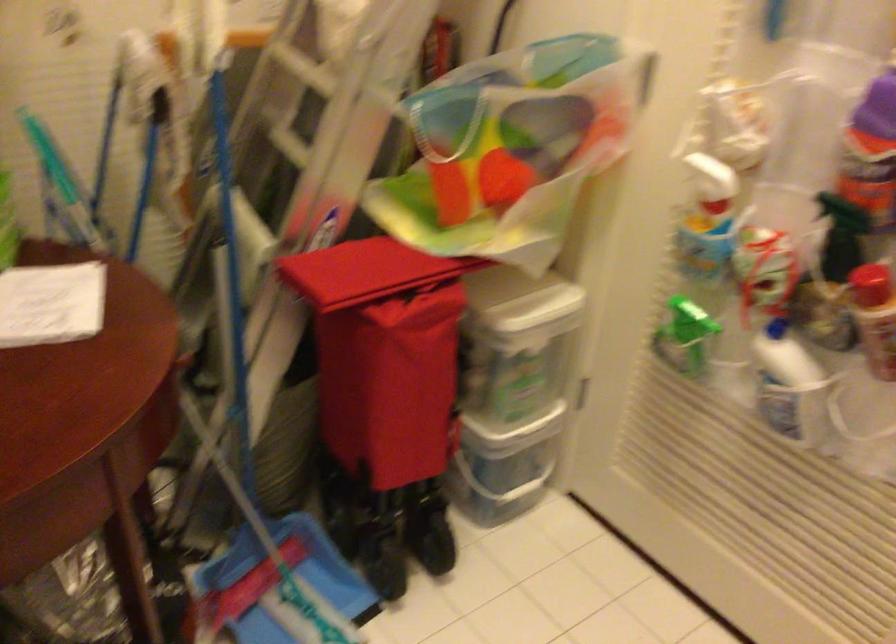
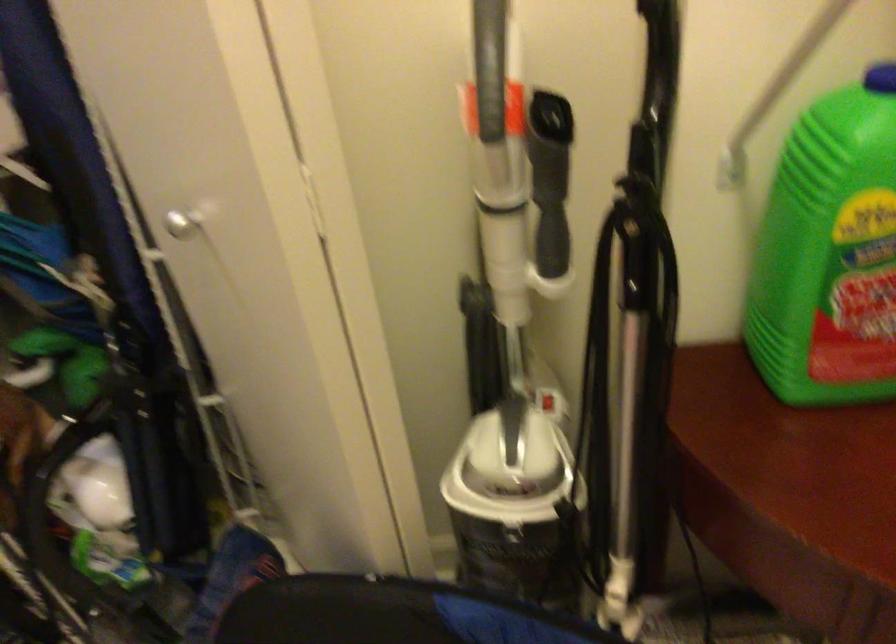
How did the camera likely rotate?

The rotation direction of the camera is left-down.